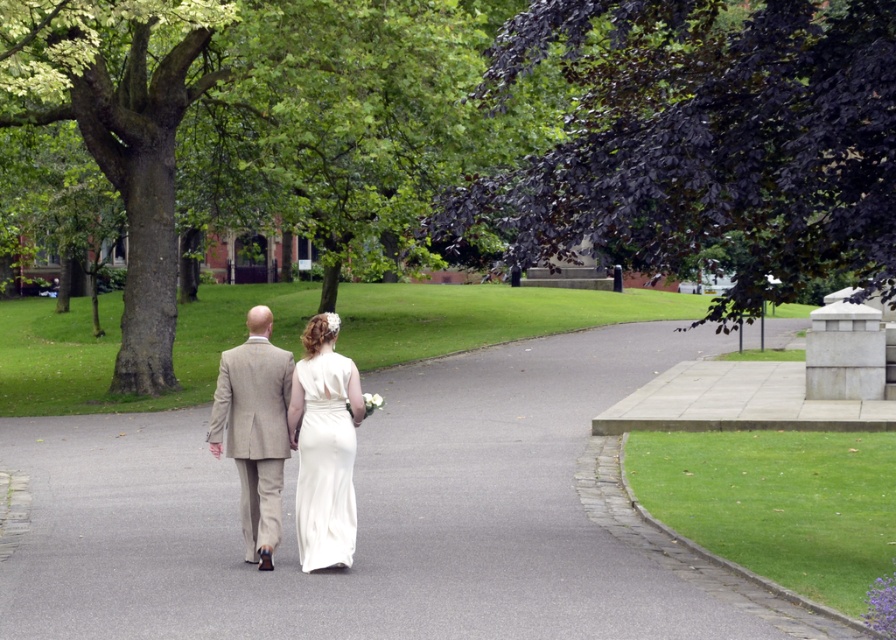
Is point (273, 387) farther from camera compared to point (311, 477)?

Yes, it is behind point (311, 477).

Is light beige suit at center above white satin dress at center?

Indeed, light beige suit at center is positioned over white satin dress at center.

Who is more forward, (273,524) or (323,417)?

Point (323,417) is in front.

Where is `light beige suit at center`? light beige suit at center is located at coordinates click(x=254, y=429).

Does green leafy tree at center have a larger size compared to white satin dress at center?

Indeed, green leafy tree at center has a larger size compared to white satin dress at center.

Is green leafy tree at center to the left of white satin dress at center from the viewer's perspective?

In fact, green leafy tree at center is to the right of white satin dress at center.

Does point (617, 51) come behind point (306, 529)?

Yes, point (617, 51) is farther from viewer.

At what (x,y) coordinates should I click in order to perform the action: click on green leafy tree at center. Please return your answer as a coordinate pair (x, y). Looking at the image, I should click on (702, 140).

Does gray asphalt pavement at center appear on the right side of light beige suit at center?

Incorrect, gray asphalt pavement at center is not on the right side of light beige suit at center.

Can you confirm if gray asphalt pavement at center is wider than light beige suit at center?

Correct, the width of gray asphalt pavement at center exceeds that of light beige suit at center.

Is point (222, 602) farther from viewer compared to point (211, 452)?

No, (222, 602) is in front of (211, 452).

The height and width of the screenshot is (640, 896). Find the location of `gray asphalt pavement at center`. gray asphalt pavement at center is located at coordinates (382, 516).